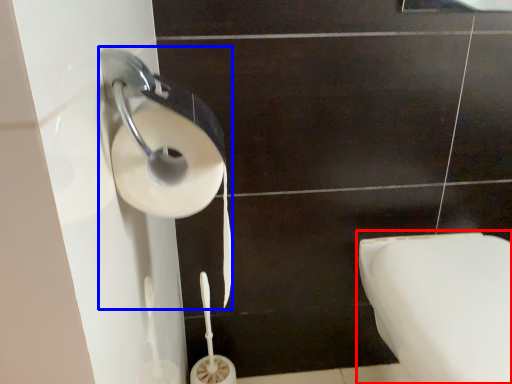
Question: Which object appears closest to the camera in this image, toilet (highlighted by a red box) or toilet paper (highlighted by a blue box)?

Choices:
 (A) toilet
 (B) toilet paper

Answer: (B)